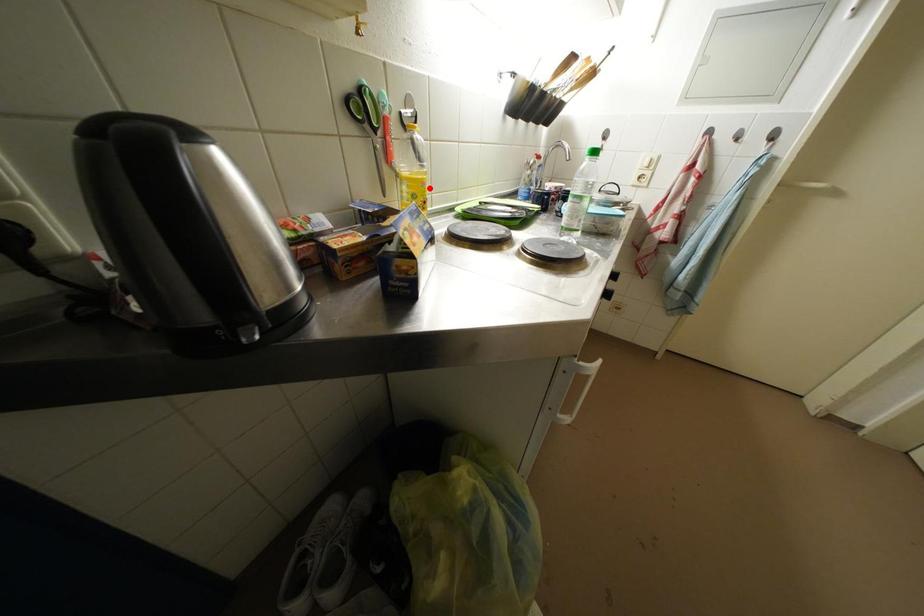
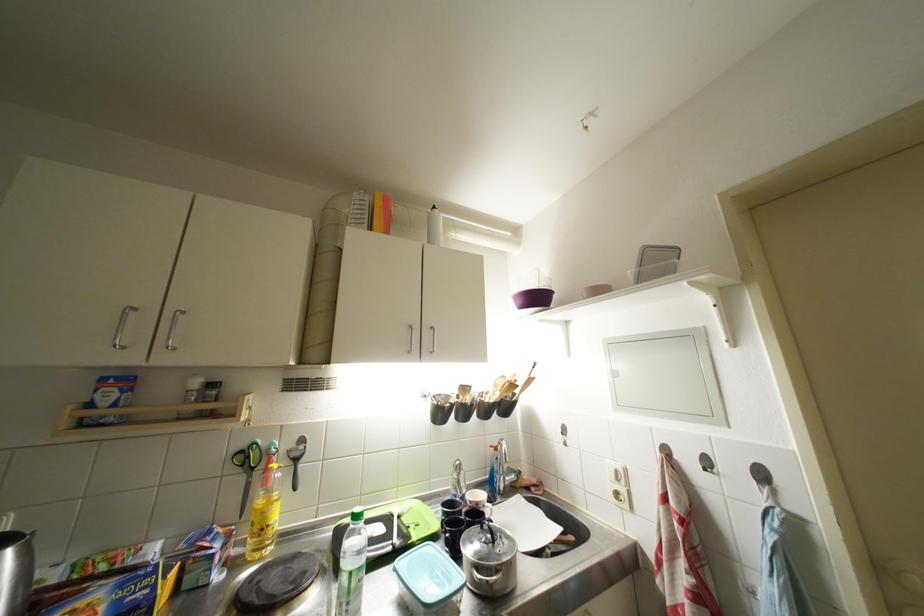
Where in the second image is the point corresponding to the highlighted location from the first image?

(271, 517)